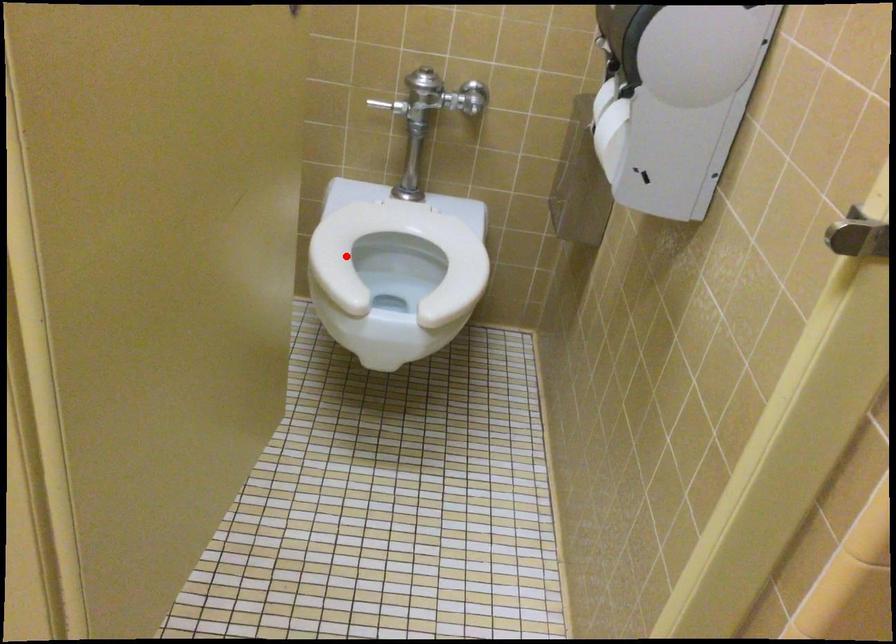
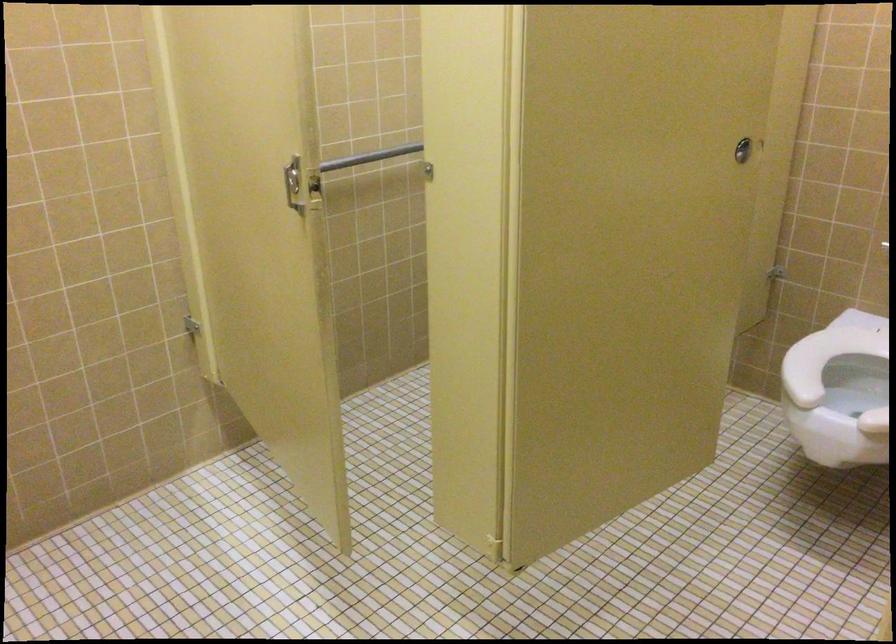
Find the pixel in the second image that matches the highlighted location in the first image.

(836, 362)